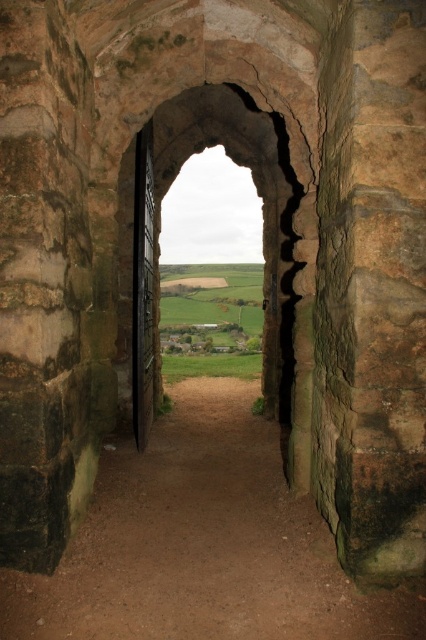
Where is `brown dirt path at center`? This screenshot has height=640, width=426. brown dirt path at center is located at coordinates (203, 545).

Is point (158, 436) in front of point (118, 332)?

That is True.

Who is more distant from viewer, (262, 481) or (294, 346)?

Point (262, 481)

Identify the location of brown dirt path at center. (203, 545).